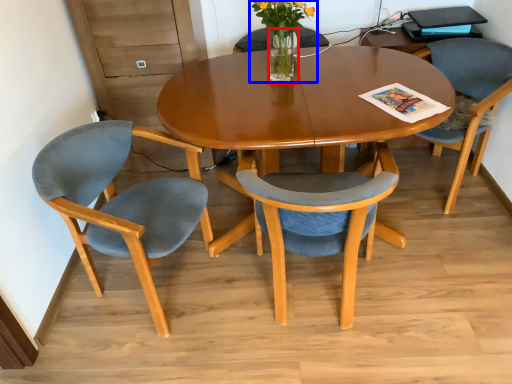
Question: Which point is further to the camera, vase (highlighted by a red box) or floral arrangement (highlighted by a blue box)?

Choices:
 (A) vase
 (B) floral arrangement

Answer: (A)